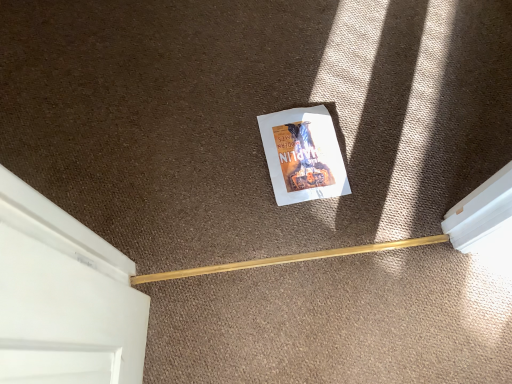
What are the coordinates of `vacant space positioned to the left of matte paper book at center` in the screenshot? It's located at (224, 162).